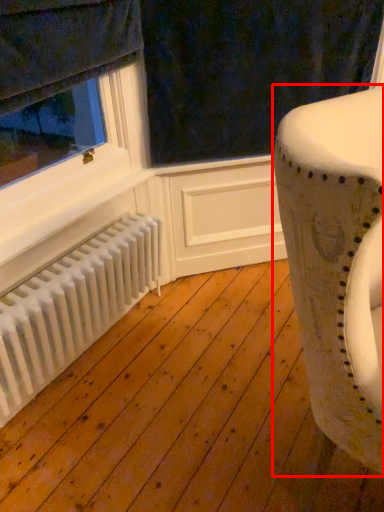
Question: Observing the image, what is the correct spatial positioning of furniture (annotated by the red box) in reference to radiator?

Choices:
 (A) right
 (B) left

Answer: (A)